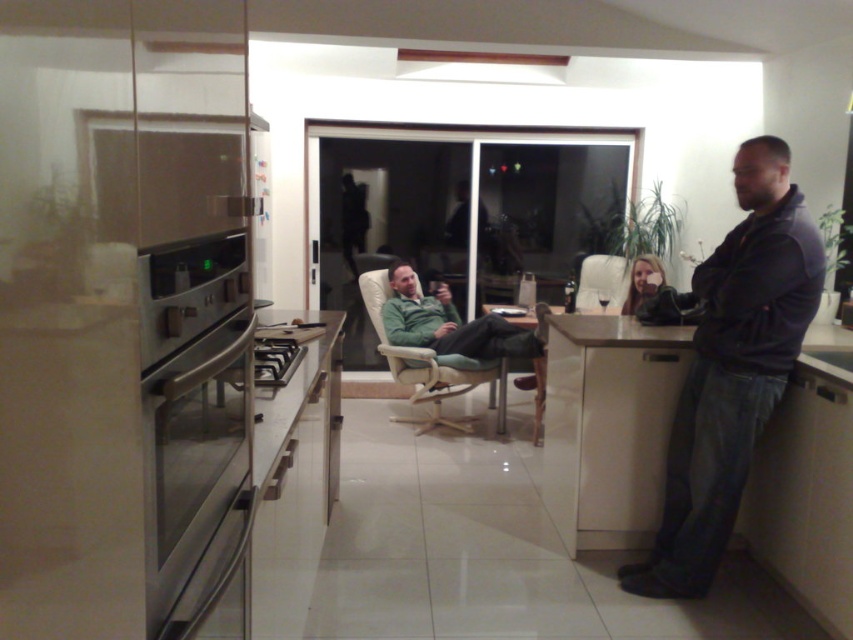
Question: Which is nearer to the dark blue leather jacket at right?

Choices:
 (A) matte black hair at center
 (B) stainless steel oven at left
 (C) light beige fabric armchair at center
 (D) white leather armchair at center

Answer: (A)

Question: Does stainless steel oven at left have a greater width compared to light beige fabric armchair at center?

Choices:
 (A) yes
 (B) no

Answer: (B)

Question: Which is farther from the stainless steel oven at left?

Choices:
 (A) white leather armchair at center
 (B) matte black hair at center
 (C) dark blue leather jacket at right

Answer: (A)

Question: Among these points, which one is nearest to the camera?

Choices:
 (A) (647, 577)
 (B) (367, 310)

Answer: (A)

Question: Where is stainless steel oven at left located in relation to light beige fabric armchair at center in the image?

Choices:
 (A) left
 (B) right

Answer: (A)

Question: Does dark blue leather jacket at right have a greater width compared to white leather armchair at center?

Choices:
 (A) yes
 (B) no

Answer: (A)